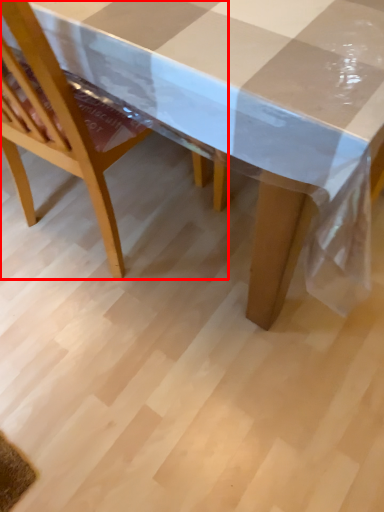
Question: From the image's perspective, what is the correct spatial positioning of chair (annotated by the red box) in reference to picnic table?

Choices:
 (A) below
 (B) above

Answer: (A)